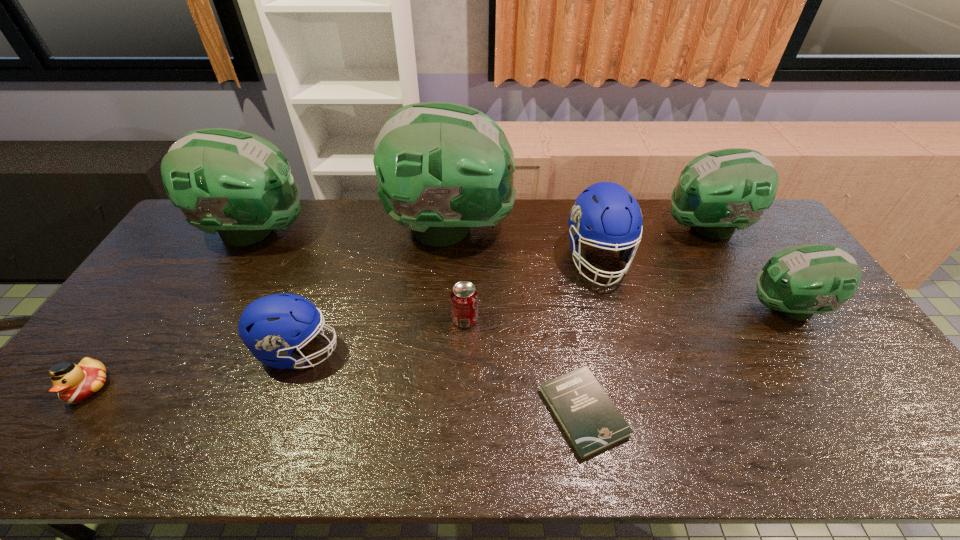
At what (x,y) coordinates should I click in order to perform the action: click on vacant area between the second smallest green football helmet and the third smallest green football helmet. Please return your answer as a coordinate pair (x, y). This screenshot has height=540, width=960. Looking at the image, I should click on (481, 230).

This screenshot has height=540, width=960. What are the coordinates of `empty space that is in between the nearer blue football helmet and the red duck` in the screenshot? It's located at (193, 369).

Locate an element on the screen. The image size is (960, 540). vacant space that's between the soda can and the bigger blue football helmet is located at coordinates (532, 289).

Locate an element on the screen. The width and height of the screenshot is (960, 540). vacant area that lies between the leftmost green football helmet and the right blue football helmet is located at coordinates (427, 245).

Image resolution: width=960 pixels, height=540 pixels. I want to click on free space between the red duck and the third biggest green football helmet, so click(x=397, y=307).

This screenshot has height=540, width=960. Find the location of `free spot between the smaller blue football helmet and the eighth tallest object`. free spot between the smaller blue football helmet and the eighth tallest object is located at coordinates (193, 369).

Locate an element on the screen. The image size is (960, 540). unoccupied area between the shortest object and the soda can is located at coordinates (524, 366).

Where is `vacant area that lies between the third smallest green football helmet and the smallest green football helmet`? The height and width of the screenshot is (540, 960). vacant area that lies between the third smallest green football helmet and the smallest green football helmet is located at coordinates (521, 269).

Locate which object ranks eighth in proximity to the book. Please provide its 2D coordinates. Your answer should be formatted as a tuple, i.e. [(x, y)], where the tuple contains the x and y coordinates of a point satisfying the conditions above.

[(74, 383)]

Choose which object is the sixth nearest neighbor to the third green football helmet from right to left. Please provide its 2D coordinates. Your answer should be formatted as a tuple, i.e. [(x, y)], where the tuple contains the x and y coordinates of a point satisfying the conditions above.

[(719, 191)]